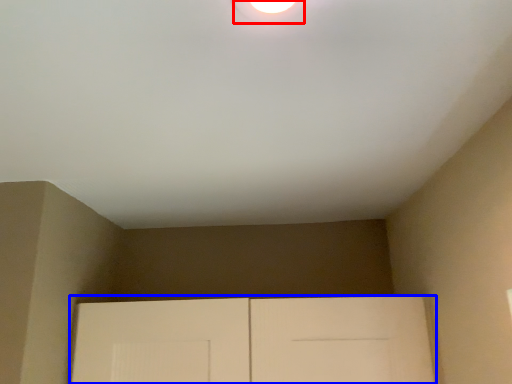
Question: Which point is closer to the camera, droplight (highlighted by a red box) or door (highlighted by a blue box)?

Choices:
 (A) droplight
 (B) door

Answer: (A)